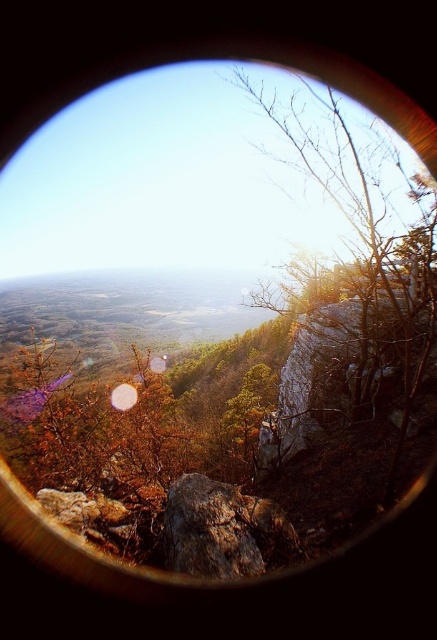
Is brown textured tree at right shorter than transparent glass lens at center?

No, brown textured tree at right is not shorter than transparent glass lens at center.

Does brown textured tree at right come in front of transparent glass lens at center?

Yes.

Identify the location of brown textured tree at right. (353, 273).

This screenshot has height=640, width=437. I want to click on brown textured tree at right, so click(x=353, y=273).

Between rusty rock at center and transparent glass lens at center, which one has less height?

rusty rock at center

Who is more distant from viewer, (221, 573) or (124, 392)?

Point (124, 392)

Image resolution: width=437 pixels, height=640 pixels. Describe the element at coordinates (222, 531) in the screenshot. I see `rusty rock at center` at that location.

Identify the location of rusty rock at center. (222, 531).

Is point (378, 296) farther from camera compared to point (291, 524)?

Yes, point (378, 296) is behind point (291, 524).

Which is behind, point (420, 184) or point (232, 516)?

Point (420, 184)

This screenshot has width=437, height=640. Identify the location of brown textured tree at right. (353, 273).